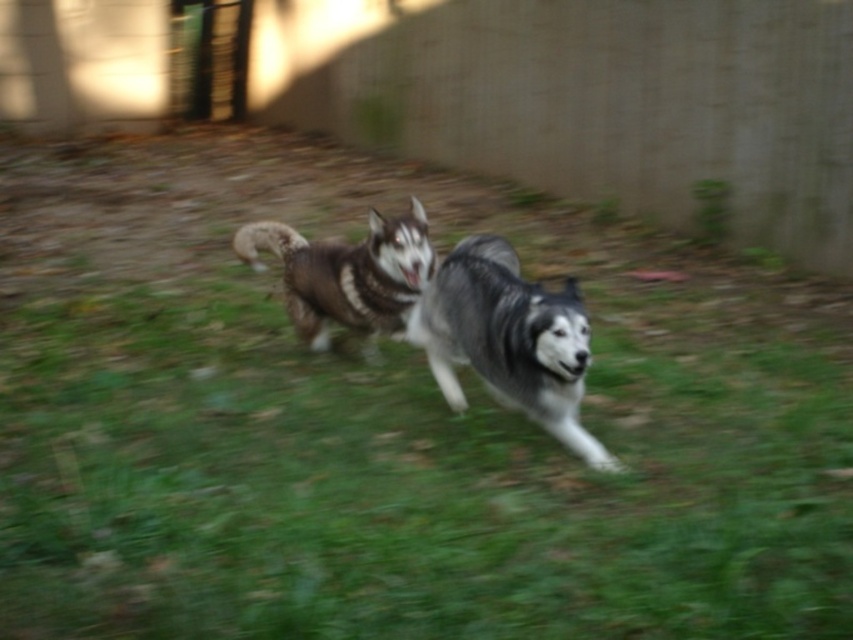
You are a dog owner who wants to ensure your husky stays dry while playing. Given the scene, where should you direct the brown fur husky at center to avoid the green grass at center?

The green grass at center is located below the brown fur husky at center, so directing the brown fur husky at center to move away from the green grass at center would help keep it dry.

You are standing in the backyard where the two dogs are playing. You notice two points marked on the ground at coordinates point (453, 292) and point (367, 237). Which point is closer to you?

Point (453, 292) is closer to the viewer than point (367, 237).